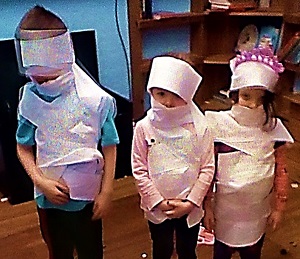
Image resolution: width=300 pixels, height=259 pixels. I want to click on tv, so click(11, 82), click(86, 43).